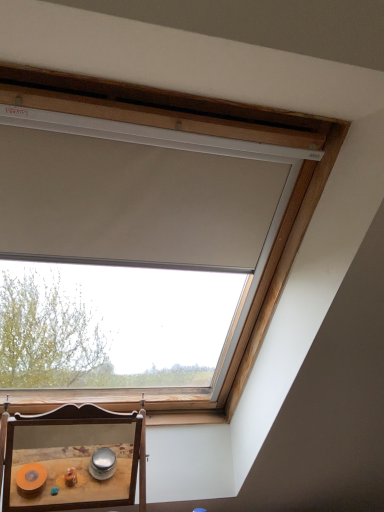
The image size is (384, 512). In order to click on wooden table at lower left in this screenshot , I will do `click(71, 463)`.

What do you see at coordinates (71, 463) in the screenshot?
I see `wooden table at lower left` at bounding box center [71, 463].

I want to click on wooden table at lower left, so click(71, 463).